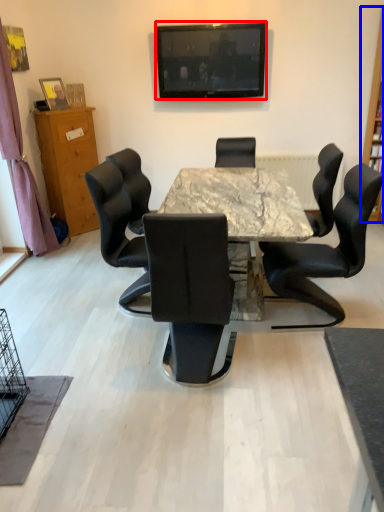
Question: Which point is closer to the camera, television (highlighted by a red box) or bookshelf (highlighted by a blue box)?

Choices:
 (A) television
 (B) bookshelf

Answer: (B)